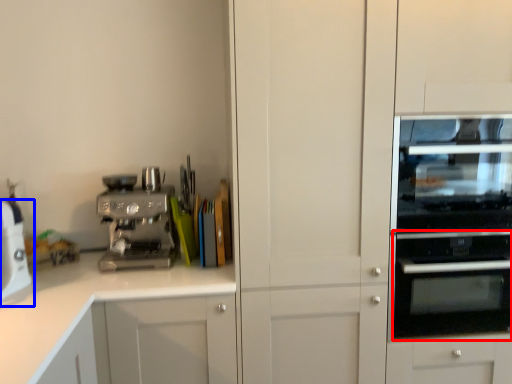
Question: Which object appears closest to the camera in this image, oven (highlighted by a red box) or home appliance (highlighted by a blue box)?

Choices:
 (A) oven
 (B) home appliance

Answer: (B)